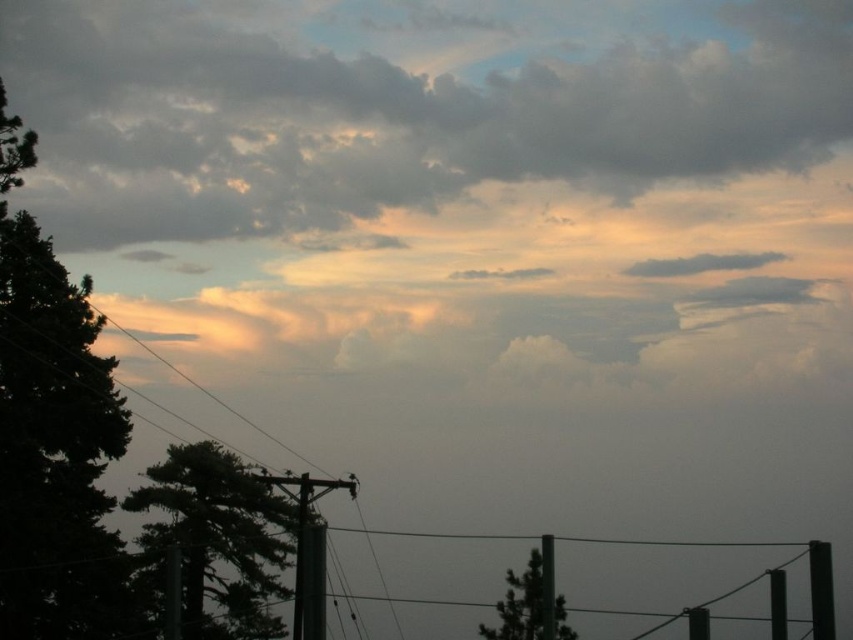
Question: Does green leafy tree at lower left have a smaller size compared to black matte pole at right?

Choices:
 (A) no
 (B) yes

Answer: (A)

Question: Which of the following is the farthest from the observer?

Choices:
 (A) (223, 616)
 (B) (305, 520)
 (C) (822, 612)
 (D) (19, 604)

Answer: (A)

Question: Which of the following is the closest to the observer?

Choices:
 (A) (39, 560)
 (B) (305, 474)

Answer: (A)

Question: In this image, where is green leafy tree at left located relative to green matte tree at lower center?

Choices:
 (A) right
 (B) left

Answer: (B)

Question: Is cloudy sky at upper center thinner than smooth wood pole at center?

Choices:
 (A) yes
 (B) no

Answer: (B)

Question: Which point is farther to the camera?

Choices:
 (A) green leafy tree at lower left
 (B) smooth gray pole at center

Answer: (B)